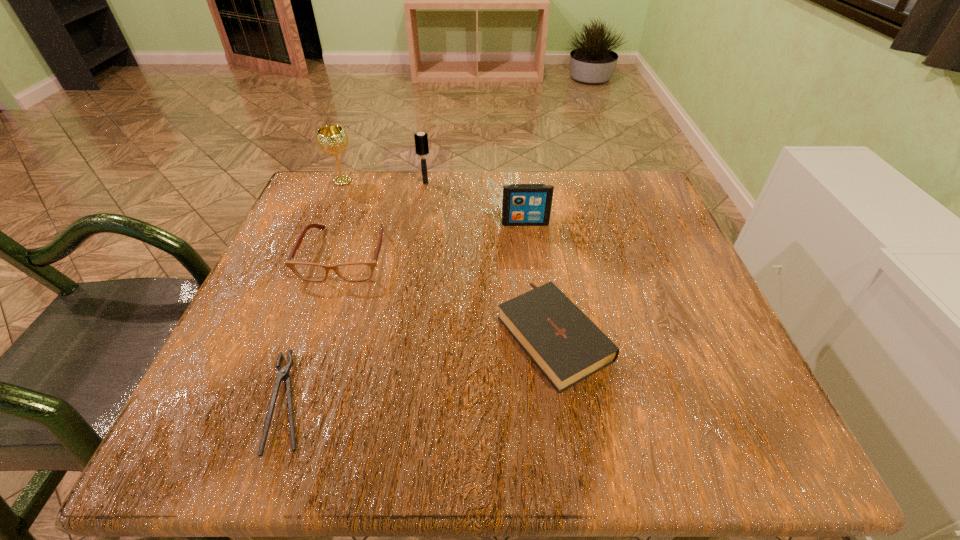
This screenshot has height=540, width=960. What are the coordinates of `vacant area situated 0.180m on the front-facing side of the fourth tallest object` in the screenshot? It's located at (308, 364).

You are a GUI agent. You are given a task and a screenshot of the screen. Output one action in this format:
    pyautogui.click(x=<x>, y=<y>)
    Task: Click on the free space located 0.100m on the right of the Bible
    This screenshot has width=960, height=540.
    Given the screenshot: What is the action you would take?
    pyautogui.click(x=667, y=332)

I want to click on vacant space positioned on the right of the tongs, so click(x=426, y=401).

What are the coordinates of `chalice that is positioned at the far edge` in the screenshot? It's located at (331, 139).

I want to click on hairbrush present at the far edge, so click(x=421, y=142).

Where is `iPod located at the far edge`? iPod located at the far edge is located at coordinates (523, 204).

Find the location of a particular element. spectacles present at the far edge is located at coordinates [x=354, y=271].

Where is `object located in the near edge section of the desktop`? This screenshot has width=960, height=540. object located in the near edge section of the desktop is located at coordinates (283, 374).

I want to click on chalice at the left edge, so click(331, 139).

Locate an element on the screen. spectacles located at the left edge is located at coordinates (354, 271).